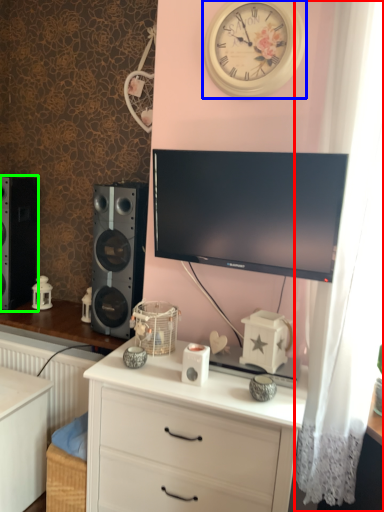
Question: Considering the real-world distances, which object is farthest from curtain (highlighted by a red box)? wall clock (highlighted by a blue box) or speaker (highlighted by a green box)?

Choices:
 (A) wall clock
 (B) speaker

Answer: (B)